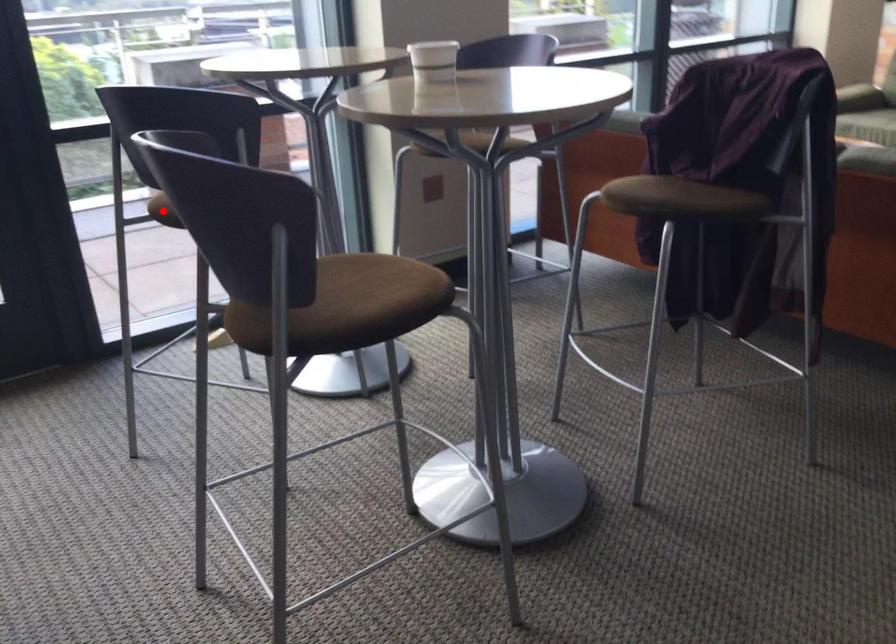
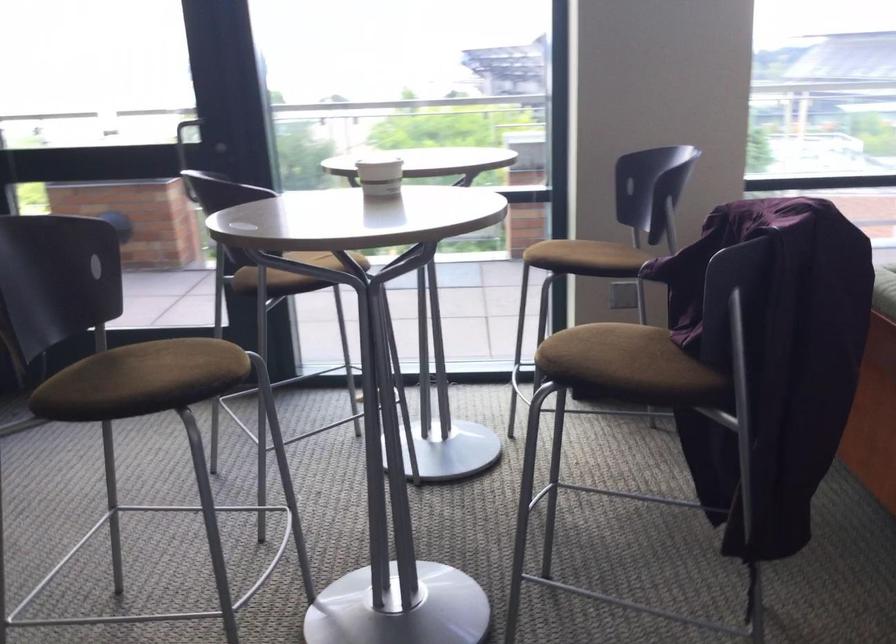
Question: I am providing you with two images of the same scene from different viewpoints. A red point is marked on the first image. At the location where the point appears in image 1, is it still visible in image 2?

Choices:
 (A) Yes
 (B) No

Answer: (B)